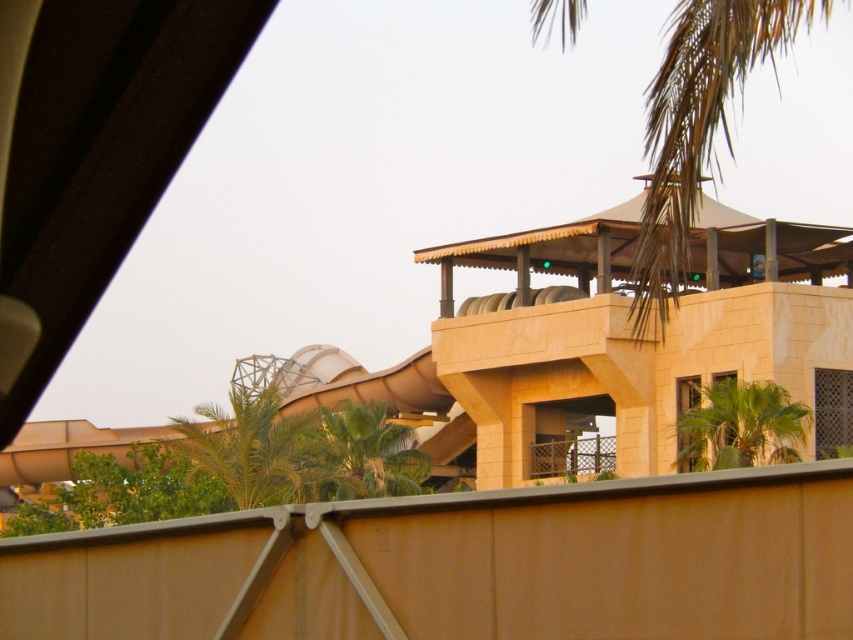
Question: Which object appears closest to the camera in this image?

Choices:
 (A) green leafy palm tree at lower right
 (B) green leafy palm tree at center

Answer: (A)

Question: Can you confirm if green leafy palm tree at lower left is positioned below green leafy palm tree at center?

Choices:
 (A) no
 (B) yes

Answer: (B)

Question: Which point is closer to the camera?

Choices:
 (A) green leafy palm tree at upper right
 (B) green leafy palm tree at center
 (C) green leafy palm tree at lower right
 (D) green leafy palm tree at lower left

Answer: (A)

Question: Which of the following is the closest to the observer?

Choices:
 (A) green leafy palm tree at upper right
 (B) green leafy palm tree at lower right
 (C) green leafy palm tree at lower left
 (D) green leafy palm tree at center

Answer: (A)

Question: Does green leafy palm tree at upper right have a larger size compared to green leafy palm tree at center?

Choices:
 (A) yes
 (B) no

Answer: (A)

Question: Is green leafy palm tree at upper right wider than green leafy palm tree at lower right?

Choices:
 (A) yes
 (B) no

Answer: (A)